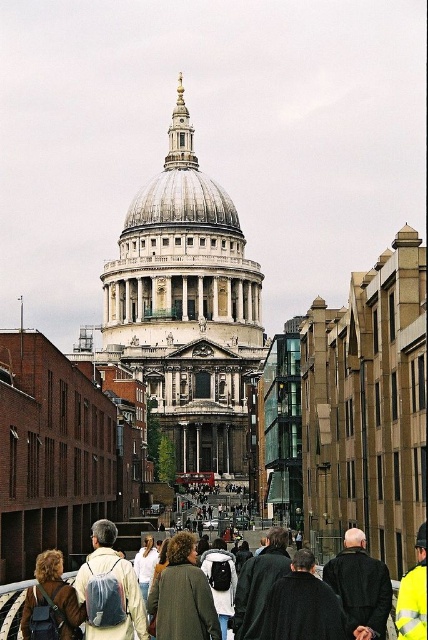
Can you confirm if brown leather backpack at lower left is thinner than yellow reflective jacket at center?

Indeed, brown leather backpack at lower left has a lesser width compared to yellow reflective jacket at center.

Between brown leather backpack at lower left and yellow reflective jacket at center, which one appears on the left side from the viewer's perspective?

Positioned to the left is brown leather backpack at lower left.

Is point (55, 634) closer to camera compared to point (395, 611)?

Yes, it is in front of point (395, 611).

The image size is (428, 640). What are the coordinates of `brown leather backpack at lower left` in the screenshot? It's located at click(50, 602).

Which is more to the left, dark brown leather coat at center or brown leather backpack at lower left?

brown leather backpack at lower left

Between dark brown leather coat at center and brown leather backpack at lower left, which one has more height?

Standing taller between the two is dark brown leather coat at center.

Identify the location of dark brown leather coat at center. (360, 582).

Who is taller, dark brown leather coat at center or yellow reflective jacket at center?

Standing taller between the two is yellow reflective jacket at center.

Is dark brown leather coat at center to the left of yellow reflective jacket at center from the viewer's perspective?

Answer: Yes, dark brown leather coat at center is to the left of yellow reflective jacket at center.

Find the location of a particular element. Image resolution: width=428 pixels, height=640 pixels. dark brown leather coat at center is located at coordinates (360, 582).

Identify the location of dark brown leather coat at center. (360, 582).